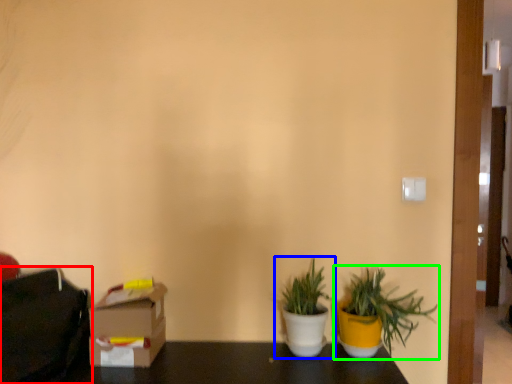
Question: Which object is the farthest from bag (highlighted by a red box)? Choose among these: houseplant (highlighted by a blue box) or houseplant (highlighted by a green box).

Choices:
 (A) houseplant
 (B) houseplant

Answer: (B)